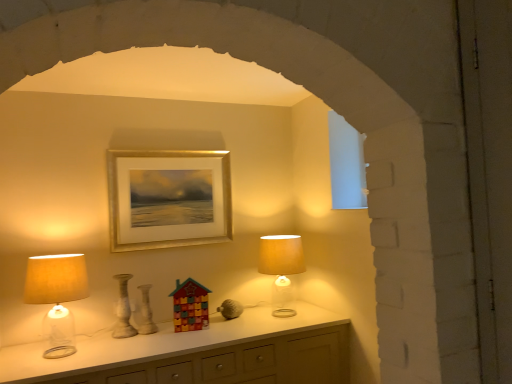
Question: Should I look upward or downward to see white glossy vase at center, the second vase in the left-to-right sequence?

Choices:
 (A) down
 (B) up

Answer: (A)

Question: Is gold metallic picture frame at upper center positioned with its back to speckled ceramic vase at center, the second vase positioned from the right?

Choices:
 (A) no
 (B) yes

Answer: (A)

Question: Is gold metallic picture frame at upper center to the left of speckled ceramic vase at center, which is the 1th vase from left to right, from the viewer's perspective?

Choices:
 (A) yes
 (B) no

Answer: (B)

Question: From a real-world perspective, is gold metallic picture frame at upper center under speckled ceramic vase at center, which is the 1th vase from left to right?

Choices:
 (A) no
 (B) yes

Answer: (A)

Question: Is gold metallic picture frame at upper center oriented towards speckled ceramic vase at center, the second vase positioned from the right?

Choices:
 (A) no
 (B) yes

Answer: (A)

Question: Can you confirm if gold metallic picture frame at upper center is taller than speckled ceramic vase at center, which is the 1th vase from left to right?

Choices:
 (A) no
 (B) yes

Answer: (B)

Question: Is speckled ceramic vase at center, the second vase positioned from the right, surrounded by gold metallic picture frame at upper center?

Choices:
 (A) no
 (B) yes

Answer: (A)

Question: From the image's perspective, is white glossy vase at center, which is the first vase from right to left, below matte beige lampshade at left, which appears as the second lamp when viewed from the back?

Choices:
 (A) yes
 (B) no

Answer: (A)

Question: Are white glossy vase at center, which is the first vase from right to left, and matte beige lampshade at left, which appears as the 1th lamp when viewed from the front, far apart?

Choices:
 (A) yes
 (B) no

Answer: (B)

Question: Is white glossy vase at center, the second vase in the left-to-right sequence, facing towards matte beige lampshade at left, which appears as the second lamp when viewed from the back?

Choices:
 (A) no
 (B) yes

Answer: (A)

Question: Considering the relative sizes of white glossy vase at center, the second vase in the left-to-right sequence, and matte beige lampshade at left, which is the second lamp in right-to-left order, in the image provided, is white glossy vase at center, the second vase in the left-to-right sequence, bigger than matte beige lampshade at left, which is the second lamp in right-to-left order,?

Choices:
 (A) yes
 (B) no

Answer: (B)

Question: Can you confirm if white glossy vase at center, which is the first vase from right to left, is positioned to the right of matte beige lampshade at left, which appears as the second lamp when viewed from the back?

Choices:
 (A) no
 (B) yes

Answer: (B)

Question: Does white glossy vase at center, the second vase in the left-to-right sequence, have a greater height compared to matte beige lampshade at left, the first lamp in the left-to-right sequence?

Choices:
 (A) yes
 (B) no

Answer: (B)

Question: From the image's perspective, does white glossy vase at center, which is the first vase from right to left, appear lower than gold metallic picture frame at upper center?

Choices:
 (A) yes
 (B) no

Answer: (A)